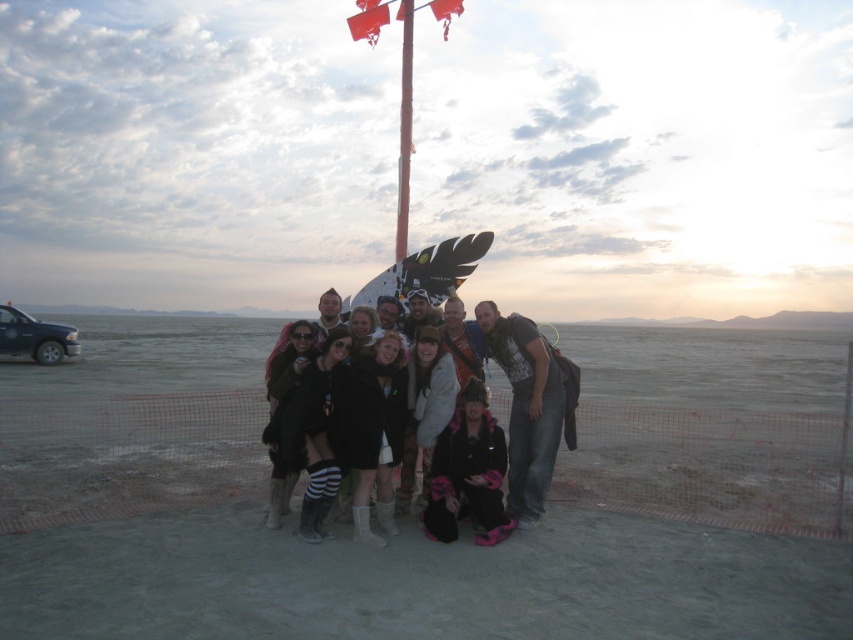
Question: Can you confirm if denim jeans at center is positioned to the right of red fabric flag at upper center?

Choices:
 (A) yes
 (B) no

Answer: (A)

Question: Which point is farther to the camera?

Choices:
 (A) (381, 12)
 (B) (305, 529)
 (C) (361, 29)

Answer: (C)

Question: Is smooth red pole at center below white glossy flag pole at center?

Choices:
 (A) yes
 (B) no

Answer: (B)

Question: Which object is positioned farthest from the white glossy flag pole at center?

Choices:
 (A) denim jeans at center
 (B) red fabric flag at upper center
 (C) black leather jacket at center
 (D) smooth red pole at center

Answer: (C)

Question: Is black leather jacket at center further to camera compared to red fabric flag at upper center?

Choices:
 (A) yes
 (B) no

Answer: (B)

Question: Which object is farther from the camera taking this photo?

Choices:
 (A) white glossy flag pole at center
 (B) denim jeans at center
 (C) smooth red pole at center

Answer: (C)